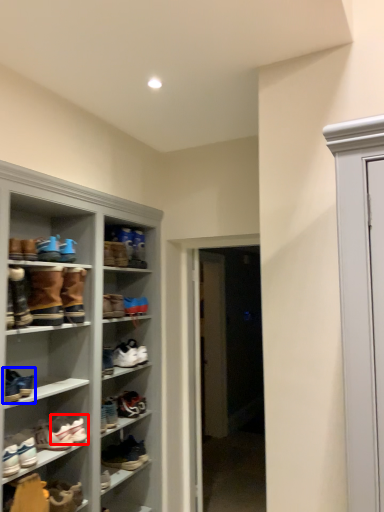
Question: Which point is closer to the camera, footwear (highlighted by a red box) or footwear (highlighted by a blue box)?

Choices:
 (A) footwear
 (B) footwear

Answer: (B)